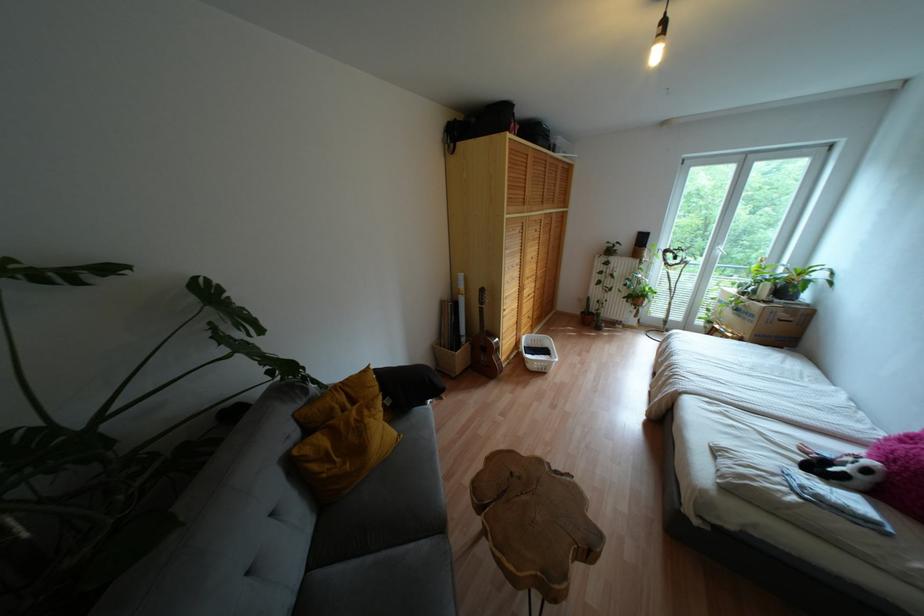
I want to click on white door handle, so click(x=720, y=251).